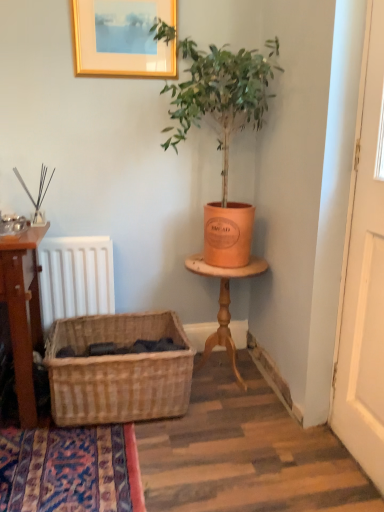
Question: Is white wooden door at right closer to the viewer compared to gold wooden picture frame at upper center?

Choices:
 (A) yes
 (B) no

Answer: (A)

Question: Does white wooden door at right have a smaller size compared to gold wooden picture frame at upper center?

Choices:
 (A) no
 (B) yes

Answer: (A)

Question: Is white wooden door at right thinner than gold wooden picture frame at upper center?

Choices:
 (A) yes
 (B) no

Answer: (A)

Question: Is white wooden door at right not close to gold wooden picture frame at upper center?

Choices:
 (A) yes
 (B) no

Answer: (A)

Question: Could you tell me if white wooden door at right is facing gold wooden picture frame at upper center?

Choices:
 (A) no
 (B) yes

Answer: (A)

Question: Does white wooden door at right have a greater height compared to gold wooden picture frame at upper center?

Choices:
 (A) yes
 (B) no

Answer: (A)

Question: Is orange clay pot at upper right not near gold wooden picture frame at upper center?

Choices:
 (A) yes
 (B) no

Answer: (B)

Question: Can you confirm if orange clay pot at upper right is thinner than gold wooden picture frame at upper center?

Choices:
 (A) no
 (B) yes

Answer: (A)

Question: Can you confirm if orange clay pot at upper right is wider than gold wooden picture frame at upper center?

Choices:
 (A) no
 (B) yes

Answer: (B)

Question: From a real-world perspective, is orange clay pot at upper right located higher than gold wooden picture frame at upper center?

Choices:
 (A) yes
 (B) no

Answer: (B)

Question: Can you confirm if orange clay pot at upper right is taller than gold wooden picture frame at upper center?

Choices:
 (A) yes
 (B) no

Answer: (A)

Question: Is orange clay pot at upper right next to gold wooden picture frame at upper center and touching it?

Choices:
 (A) yes
 (B) no

Answer: (B)

Question: From a real-world perspective, does woven natural basket at lower left stand above white wooden door at right?

Choices:
 (A) no
 (B) yes

Answer: (A)